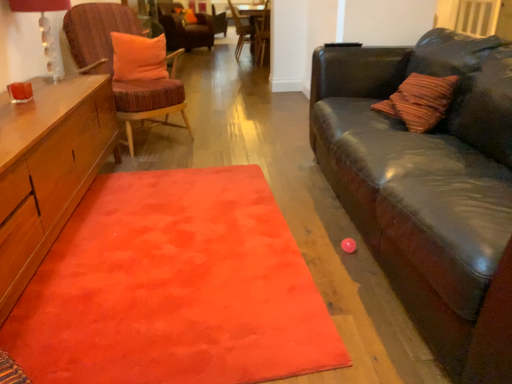
This screenshot has height=384, width=512. What are the coordinates of `spots to the right of woven wood chair with orange cushion at left, the first chair when ordered from front to back` in the screenshot? It's located at (217, 135).